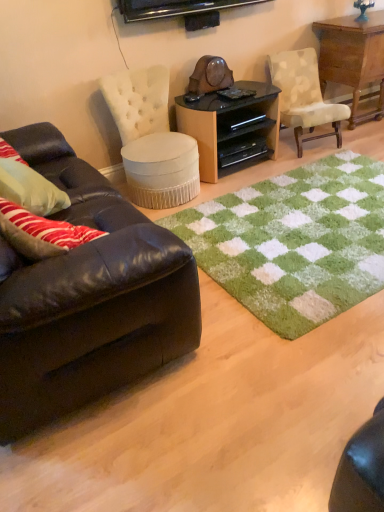
The height and width of the screenshot is (512, 384). I want to click on vacant space that's between white tufted fabric ottoman at center, which ranks as the second chair in right-to-left order, and black glossy wood desk at center, so (233, 180).